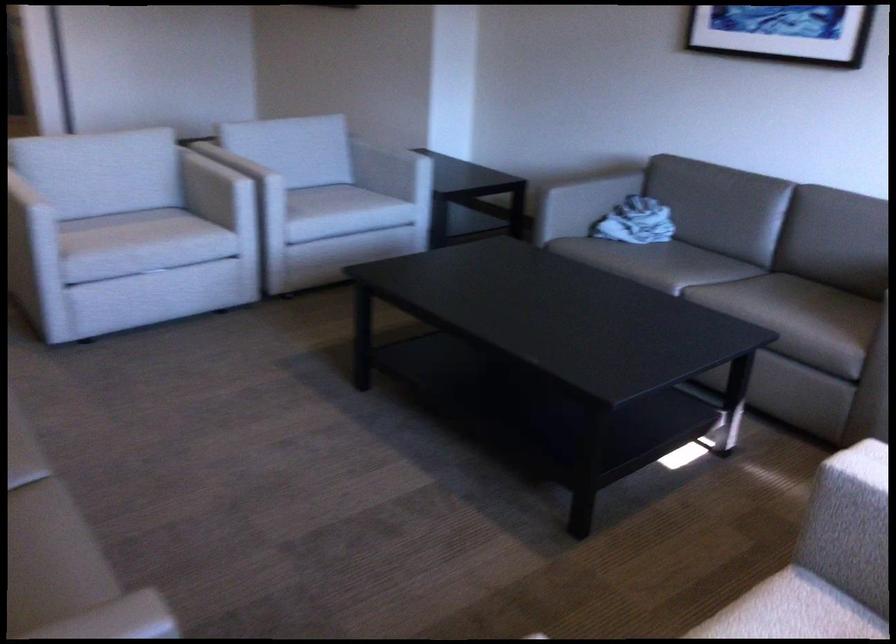
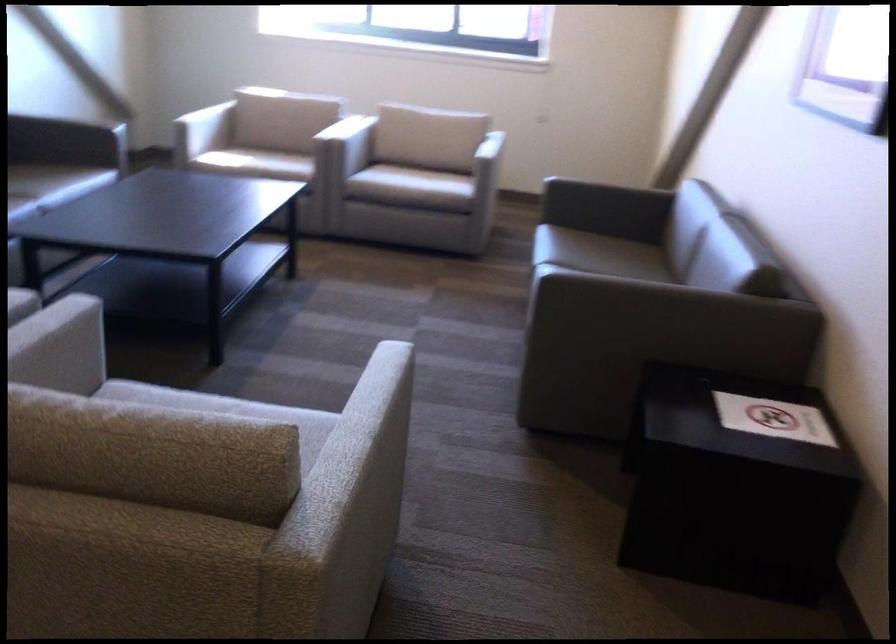
Where in the second image is the point corresponding to [220,207] from the first image?

(58, 368)